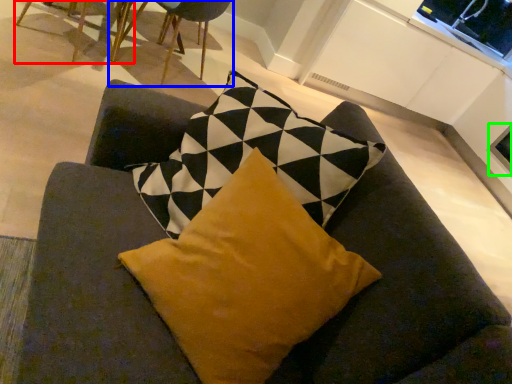
Question: Estimate the real-world distances between objects in this image. Which object is farther from chair (highlighted by a red box), chair (highlighted by a blue box) or window screen (highlighted by a green box)?

Choices:
 (A) chair
 (B) window screen

Answer: (B)